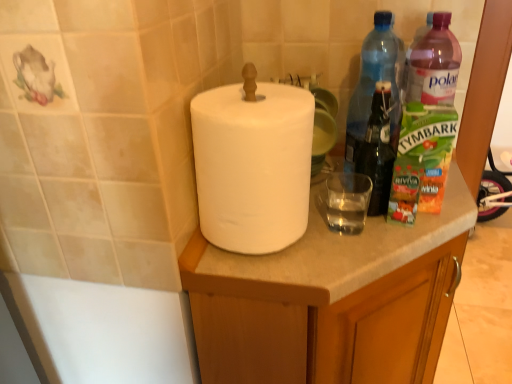
Locate an element on the screen. free space to the back side of transparent glass at center is located at coordinates (335, 190).